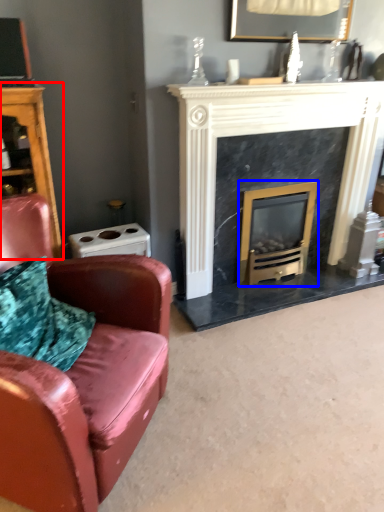
Question: Which of the following is the closest to the observer, dresser (highlighted by a red box) or wood burning stove (highlighted by a blue box)?

Choices:
 (A) dresser
 (B) wood burning stove

Answer: (A)